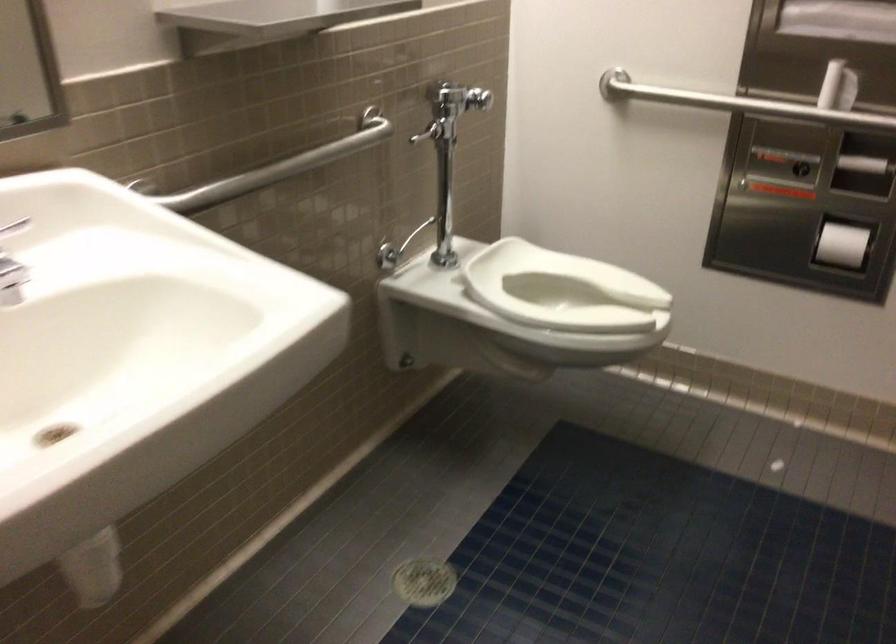
Identify the location of toilet flush lever. This screenshot has height=644, width=896. (443, 109).